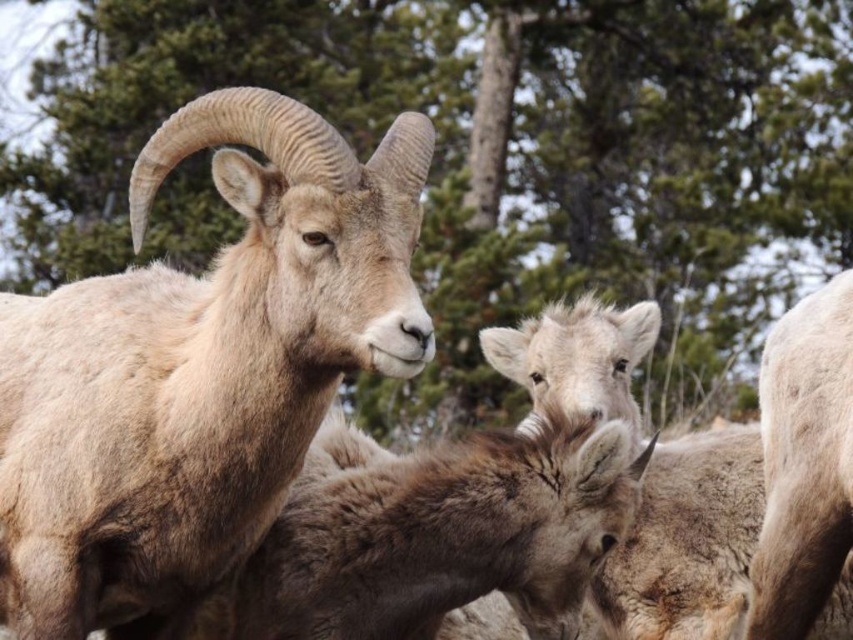
Question: Which of the following is the farthest from the observer?

Choices:
 (A) light brown woolly goat at left
 (B) fuzzy brown sheep at right
 (C) fuzzy beige sheep at center

Answer: (C)

Question: Does light brown woolly goat at left have a smaller size compared to fuzzy brown sheep at right?

Choices:
 (A) no
 (B) yes

Answer: (A)

Question: Can you confirm if fuzzy beige sheep at center is wider than fuzzy brown sheep at right?

Choices:
 (A) yes
 (B) no

Answer: (A)

Question: Is green textured tree at upper center to the right of light brown woolly goat at left from the viewer's perspective?

Choices:
 (A) yes
 (B) no

Answer: (A)

Question: Which object is positioned closest to the light brown woolly goat at left?

Choices:
 (A) fuzzy brown sheep at right
 (B) fuzzy beige sheep at center
 (C) green textured tree at upper center

Answer: (B)

Question: Which point appears farthest from the camera in this image?

Choices:
 (A) (718, 484)
 (B) (816, 358)
 (C) (416, 212)
 (D) (360, 8)

Answer: (D)